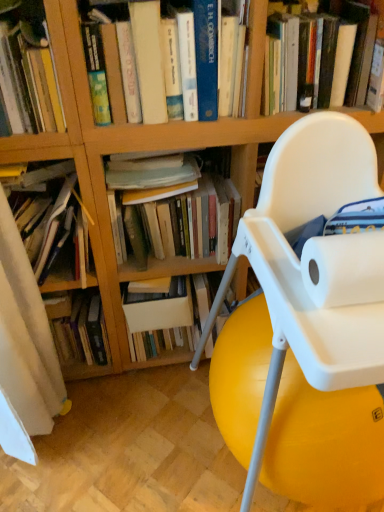
Question: In which direction should I rotate to look at hardcover book at upper center, the sixth book from the left?

Choices:
 (A) right
 (B) left

Answer: (A)

Question: Considering the relative positions of hardcover book at upper center, which is counted as the fourth book, starting from the left, and hardcover books at left, the 1th book positioned from the left, in the image provided, is hardcover book at upper center, which is counted as the fourth book, starting from the left, to the left of hardcover books at left, the 1th book positioned from the left, from the viewer's perspective?

Choices:
 (A) no
 (B) yes

Answer: (A)

Question: Is hardcover book at upper center, which is counted as the fourth book, starting from the left, thinner than hardcover books at left, the 1th book positioned from the left?

Choices:
 (A) yes
 (B) no

Answer: (A)

Question: Is hardcover book at upper center, which is counted as the fourth book, starting from the left, located outside hardcover books at left, the 1th book positioned from the left?

Choices:
 (A) no
 (B) yes

Answer: (B)

Question: Is hardcover book at upper center, positioned as the third book in right-to-left order, turned away from hardcover books at left, placed as the 6th book when sorted from right to left?

Choices:
 (A) yes
 (B) no

Answer: (B)

Question: From a real-world perspective, is hardcover book at upper center, positioned as the third book in right-to-left order, below hardcover books at left, the 1th book positioned from the left?

Choices:
 (A) yes
 (B) no

Answer: (B)

Question: Is there a large distance between hardcover book at upper center, which is counted as the fourth book, starting from the left, and hardcover books at left, placed as the 6th book when sorted from right to left?

Choices:
 (A) no
 (B) yes

Answer: (A)

Question: Could hardcover books at center, acting as the 2th book starting from the right, be considered to be inside hardcover book at upper left, the 4th book from the right?

Choices:
 (A) no
 (B) yes

Answer: (A)

Question: Considering the relative sizes of hardcover book at upper left, which is the 3th book in left-to-right order, and hardcover books at center, acting as the 2th book starting from the right, in the image provided, is hardcover book at upper left, which is the 3th book in left-to-right order, smaller than hardcover books at center, acting as the 2th book starting from the right,?

Choices:
 (A) no
 (B) yes

Answer: (B)

Question: From a real-world perspective, is hardcover book at upper left, the 4th book from the right, on top of hardcover books at center, marked as the 5th book in a left-to-right arrangement?

Choices:
 (A) yes
 (B) no

Answer: (A)

Question: Is hardcover book at upper left, which is the 3th book in left-to-right order, shorter than hardcover books at center, marked as the 5th book in a left-to-right arrangement?

Choices:
 (A) no
 (B) yes

Answer: (A)

Question: Are hardcover book at upper left, the 4th book from the right, and hardcover books at center, marked as the 5th book in a left-to-right arrangement, far apart?

Choices:
 (A) no
 (B) yes

Answer: (A)

Question: Can you confirm if hardcover book at upper left, which is the 3th book in left-to-right order, is taller than hardcover books at center, acting as the 2th book starting from the right?

Choices:
 (A) yes
 (B) no

Answer: (A)

Question: Is hardcover book at upper left, the 4th book from the right, further to camera compared to white plastic chair at center?

Choices:
 (A) no
 (B) yes

Answer: (B)